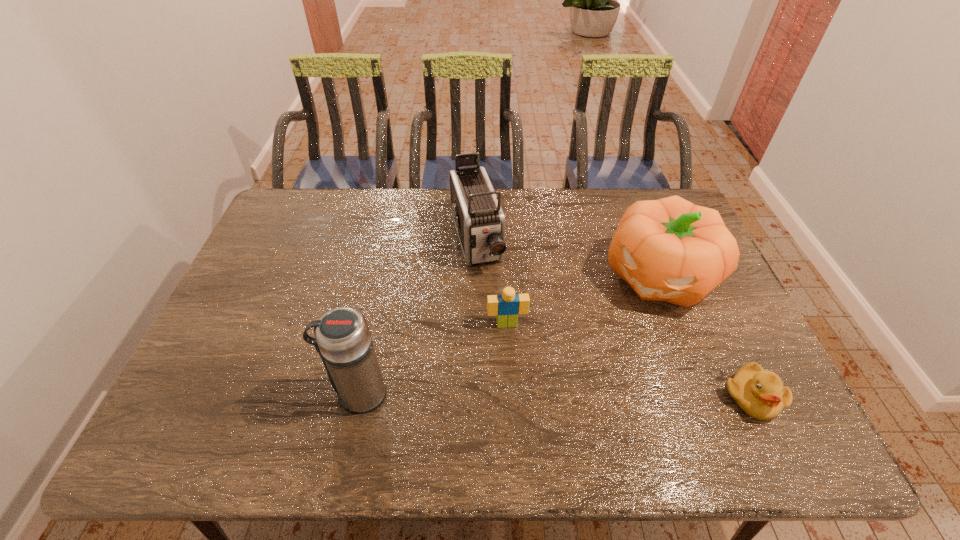
The height and width of the screenshot is (540, 960). Find the location of `vacant area between the second shortest object and the duckling`. vacant area between the second shortest object and the duckling is located at coordinates (629, 361).

The width and height of the screenshot is (960, 540). Find the location of `free area in between the shortest object and the pumpkin`. free area in between the shortest object and the pumpkin is located at coordinates point(705,336).

The image size is (960, 540). In order to click on free space between the camcorder and the second shortest object in this screenshot , I will do `click(492, 282)`.

Find the location of a particular element. The height and width of the screenshot is (540, 960). vacant region between the camcorder and the shortest object is located at coordinates (613, 319).

Locate an element on the screen. unoccupied position between the fourth tallest object and the camcorder is located at coordinates (492, 282).

The height and width of the screenshot is (540, 960). Identify the location of vacant space in between the Lego and the thermos bottle. [433, 359].

The width and height of the screenshot is (960, 540). Find the location of `vacant space that's between the Lego and the camcorder`. vacant space that's between the Lego and the camcorder is located at coordinates (492, 282).

At what (x,y) coordinates should I click in order to perform the action: click on object identified as the second closest to the second shortest object. Please return your answer as a coordinate pair (x, y). Looking at the image, I should click on [671, 250].

Identify the location of the third closest object to the shortest object. (479, 219).